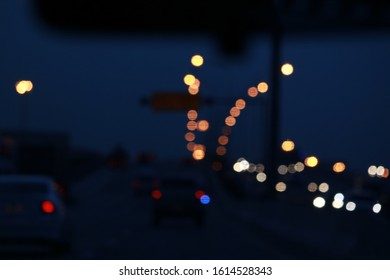
Find the location of a particular element. The image size is (390, 280). light is located at coordinates (205, 200).